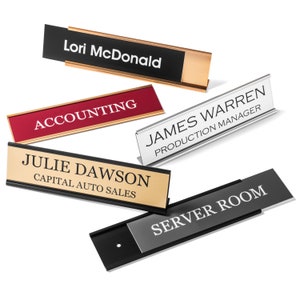
The width and height of the screenshot is (300, 300). What are the coordinates of `white surface` in the screenshot? It's located at (254, 149).